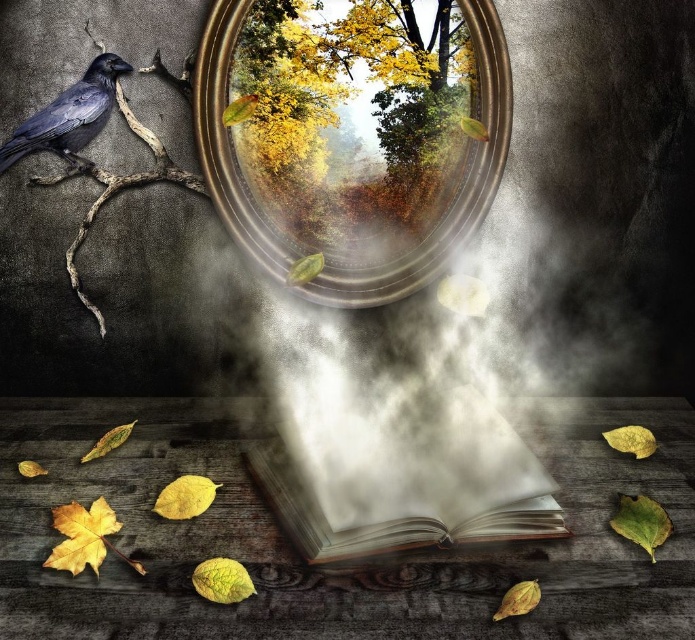
Based on the scene description, where is the yellow leafy tree at upper center located in the image?

The yellow leafy tree at upper center is located at point coordinates of 0.122 on the x axis and 0.499 on the y axis.

You are an artist trying to sketch the scene. You notice the wooden pages book at center and the shiny black crow at upper left. Which object should you draw first if you want to focus on the larger subject?

The wooden pages book at center should be drawn first because it has a larger size compared to the shiny black crow at upper left.

You are an artist trying to paint the scene. You want to ensure the proportions between the yellow leafy tree at upper center and the metallic reflective mirror at center are accurate. Which object should you paint first to maintain proper scaling?

You should paint the metallic reflective mirror at center first because the yellow leafy tree at upper center is narrower than it, so starting with the wider object ensures you leave enough space for the smaller one.